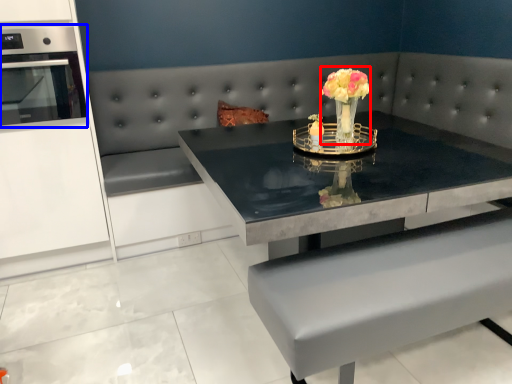
Question: Which point is closer to the camera, floral arrangement (highlighted by a red box) or appliance (highlighted by a blue box)?

Choices:
 (A) floral arrangement
 (B) appliance

Answer: (A)